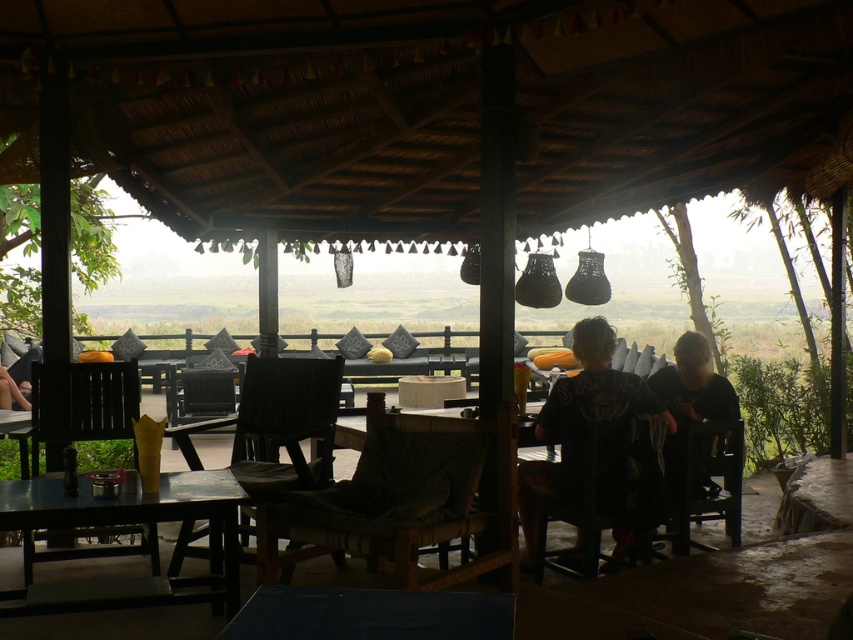
From the picture: You are a customer at the outdoor seating area and want to choose a chair that can accommodate your large backpack. Which chair between the woven brown chair at center and the dark brown wooden chair at lower right would you choose?

The woven brown chair at center is bigger than the dark brown wooden chair at lower right, so you should choose the woven brown chair at center to accommodate your large backpack.